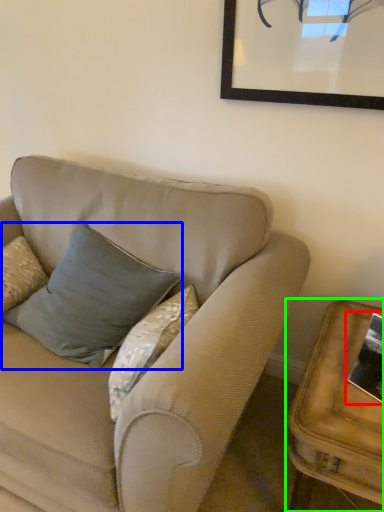
Question: Which object is the closest to the picture frame (highlighted by a red box)? Choose among these: pillow (highlighted by a blue box) or table (highlighted by a green box).

Choices:
 (A) pillow
 (B) table

Answer: (B)